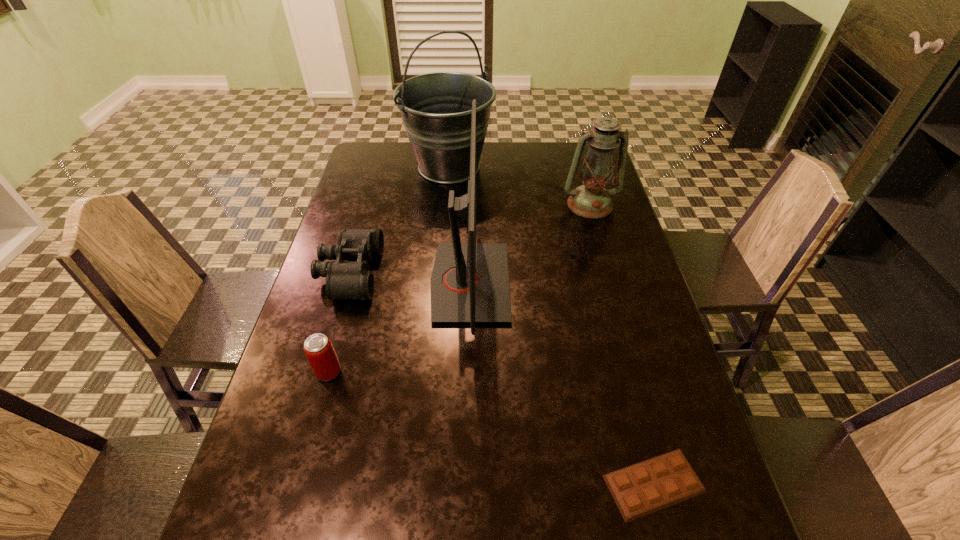
Where is `blank space at the right edge`? blank space at the right edge is located at coordinates (635, 275).

In the image, there is a desktop. At what (x,y) coordinates should I click in order to perform the action: click on vacant space at the far left corner. Please return your answer as a coordinate pair (x, y). Image resolution: width=960 pixels, height=540 pixels. Looking at the image, I should click on (377, 172).

Where is `empty space that is in between the binoculars and the monitor`? empty space that is in between the binoculars and the monitor is located at coordinates (410, 278).

Locate an element on the screen. vacant area between the shortest object and the monitor is located at coordinates (562, 383).

I want to click on free point between the bucket and the fifth tallest object, so 399,220.

Find the location of a particular element. vacant area that lies between the beer can and the binoculars is located at coordinates (339, 322).

Where is `empty space between the chocolate bar and the fourth shortest object`? The image size is (960, 540). empty space between the chocolate bar and the fourth shortest object is located at coordinates (622, 344).

Locate an element on the screen. vacant point located between the bucket and the binoculars is located at coordinates 399,220.

Where is `vacant area between the nearest object and the third tallest object`? vacant area between the nearest object and the third tallest object is located at coordinates (622, 344).

Where is `free space between the beer can and the bucket`? Image resolution: width=960 pixels, height=540 pixels. free space between the beer can and the bucket is located at coordinates point(389,269).